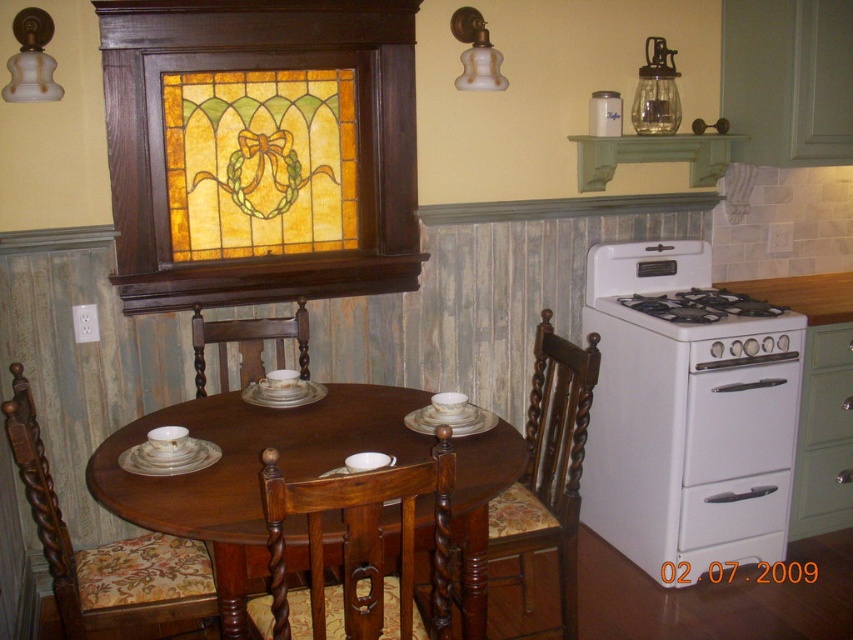
You are a chef preparing to store ingredients in the kitchen. You have a large pot that needs to be placed in one of the white glossy drawer at lower right or the white glossy gas stove at right. Based on their sizes, which one can accommodate the large pot?

The white glossy gas stove at right can accommodate the large pot since it occupies more space than the white glossy drawer at lower right.

Based on the photo, you are a guest sitting at the dining table and want to reach the white glossy gas stove at right to warm up some food. Which direction should you move relative to the floral fabric cushioned chair at center?

Since the floral fabric cushioned chair at center is to the left of the white glossy gas stove at right, you should move to the right from the floral fabric cushioned chair at center to reach the white glossy gas stove at right.

You are planning to place a new appliance that requires a space of 1.2 meters in width. You see the white matte oven at right and the white glossy drawer at lower right. Which one has enough space for the appliance?

The white matte oven at right has a larger width than the white glossy drawer at lower right, so it can accommodate the appliance requiring 1.2 meters in width if its width meets or exceeds that measurement.